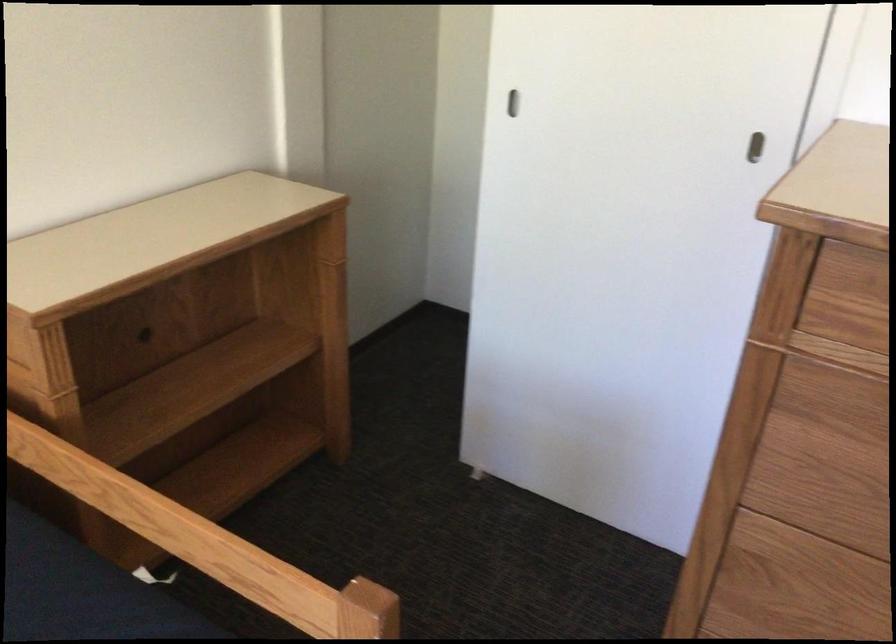
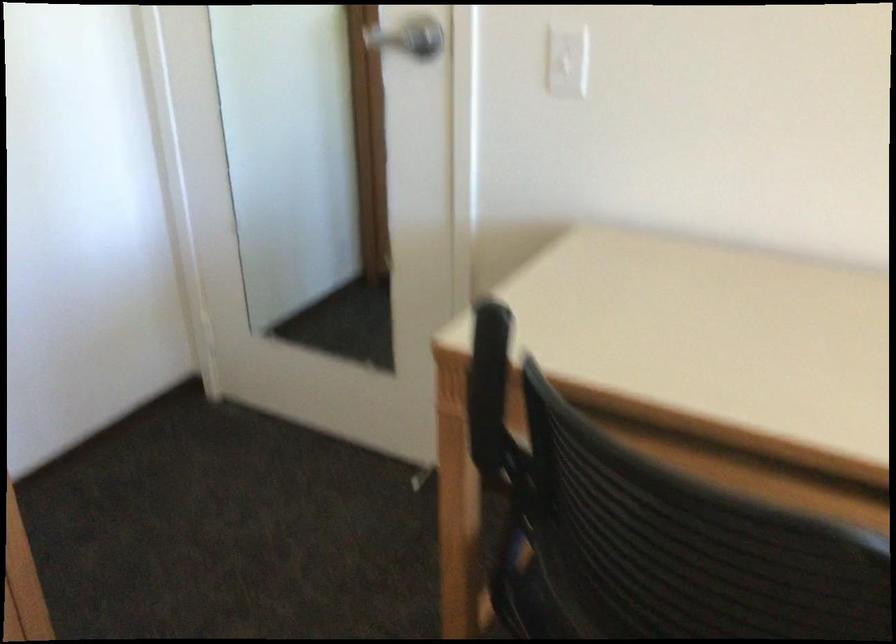
How did the camera likely rotate?

The camera rotated toward right-down.